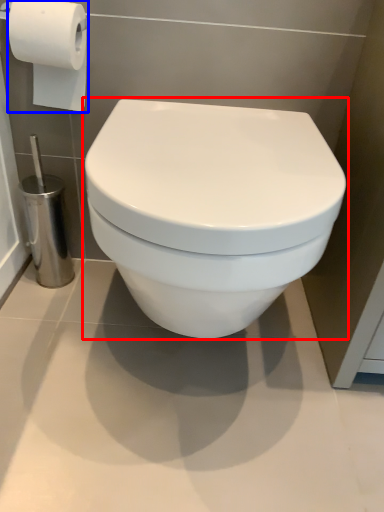
Question: Among these objects, which one is farthest to the camera, toilet (highlighted by a red box) or toilet paper (highlighted by a blue box)?

Choices:
 (A) toilet
 (B) toilet paper

Answer: (B)